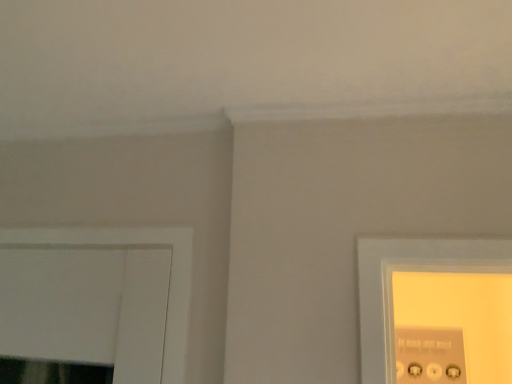
Describe the element at coordinates (430, 355) in the screenshot. I see `white plastic electric outlet at lower right` at that location.

Where is `white plastic electric outlet at lower right`? white plastic electric outlet at lower right is located at coordinates (430, 355).

Where is `white plastic electric outlet at lower right`? The image size is (512, 384). white plastic electric outlet at lower right is located at coordinates 430,355.